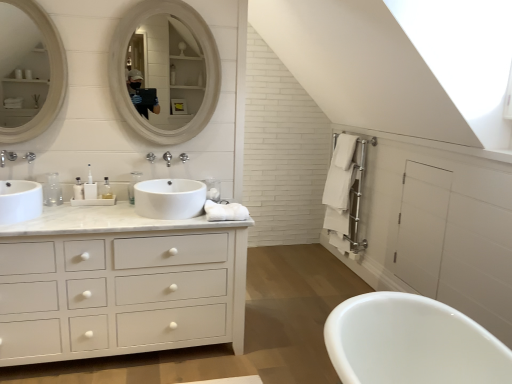
Where is `vacant space in front of clear plastic bottle at center, the first toiletry when ordered from right to left`? The image size is (512, 384). vacant space in front of clear plastic bottle at center, the first toiletry when ordered from right to left is located at coordinates (70, 211).